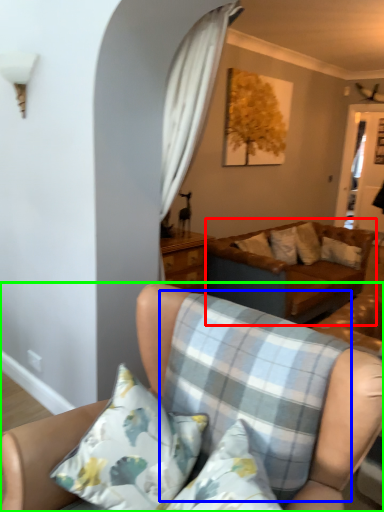
Question: Estimate the real-world distances between objects in this image. Which object is closer to studio couch (highlighted by a red box), plaid (highlighted by a blue box) or studio couch (highlighted by a green box)?

Choices:
 (A) plaid
 (B) studio couch

Answer: (A)